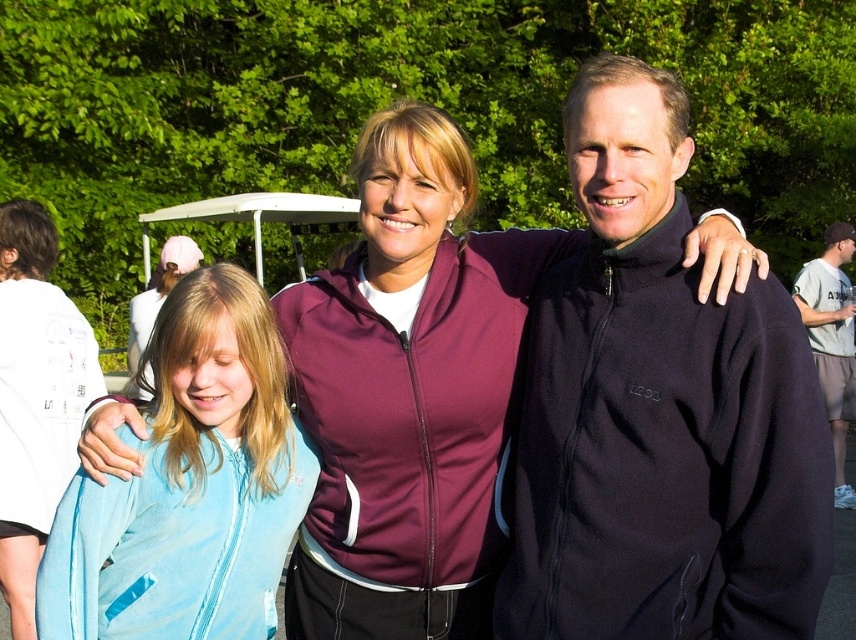
Which is in front, point (597, 125) or point (839, 225)?

Point (597, 125) is in front.

Does black softshell jacket at center have a greater width compared to gray cotton t-shirt at right?

Correct, the width of black softshell jacket at center exceeds that of gray cotton t-shirt at right.

Between point (575, 625) and point (836, 330), which one is positioned in front?

Point (575, 625) is in front.

At what (x,y) coordinates should I click in order to perform the action: click on black softshell jacket at center. Please return your answer as a coordinate pair (x, y). This screenshot has width=856, height=640. Looking at the image, I should click on (658, 412).

Locate an element on the screen. black softshell jacket at center is located at coordinates (658, 412).

Who is shorter, black softshell jacket at center or light blue fleece jacket at left?

light blue fleece jacket at left is shorter.

Does point (645, 406) lie behind point (193, 534)?

That is False.

Find the location of a particular element. black softshell jacket at center is located at coordinates (658, 412).

Does point (450, 168) lie behind point (831, 362)?

No, (450, 168) is closer to viewer.

Which is more to the left, purple softshell jacket at center or gray cotton t-shirt at right?

purple softshell jacket at center

Is point (479, 545) in front of point (797, 301)?

Yes, it is.

Identify the location of purple softshell jacket at center. (415, 364).